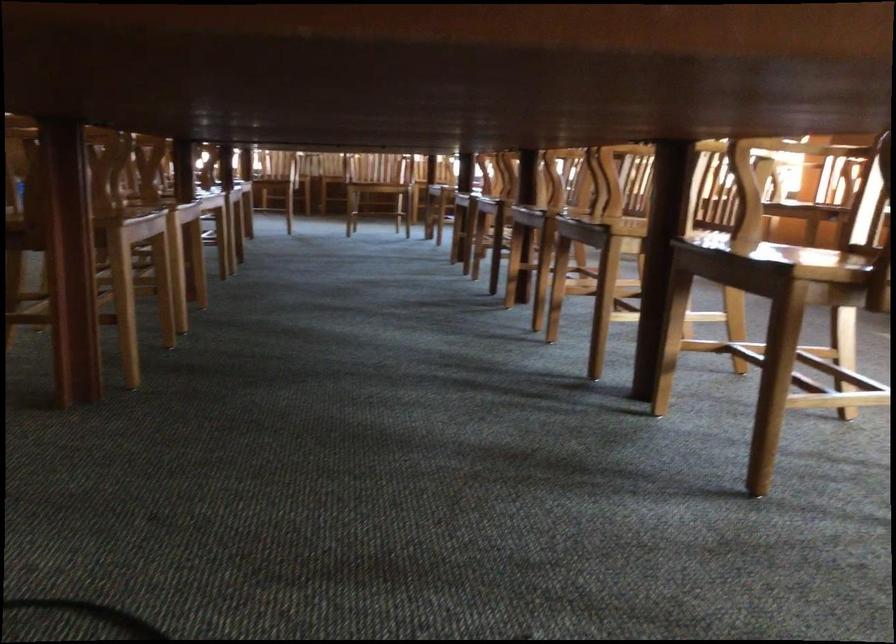
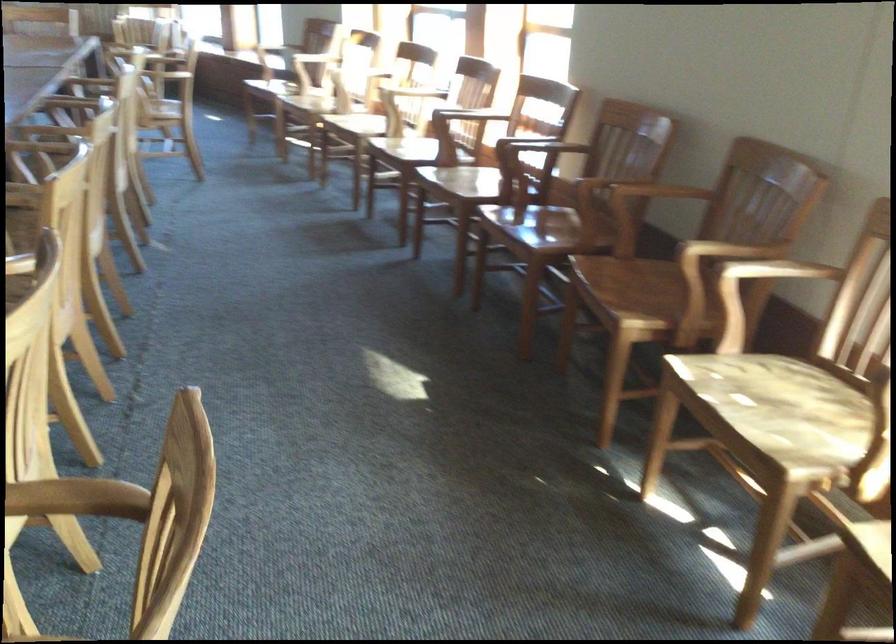
Question: The images are taken continuously from a first-person perspective. In which direction are you moving?

Choices:
 (A) Left
 (B) Right
 (C) Forward
 (D) Backward

Answer: (B)